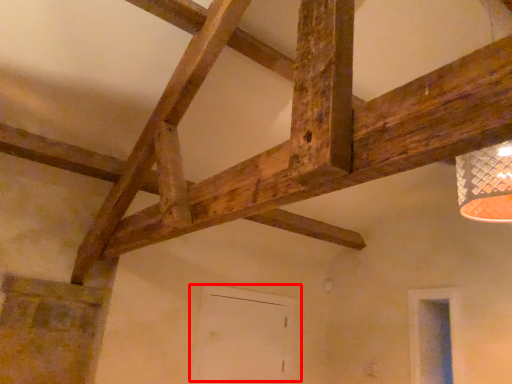
Question: In this image, where is door (annotated by the red box) located relative to window?

Choices:
 (A) right
 (B) left

Answer: (B)